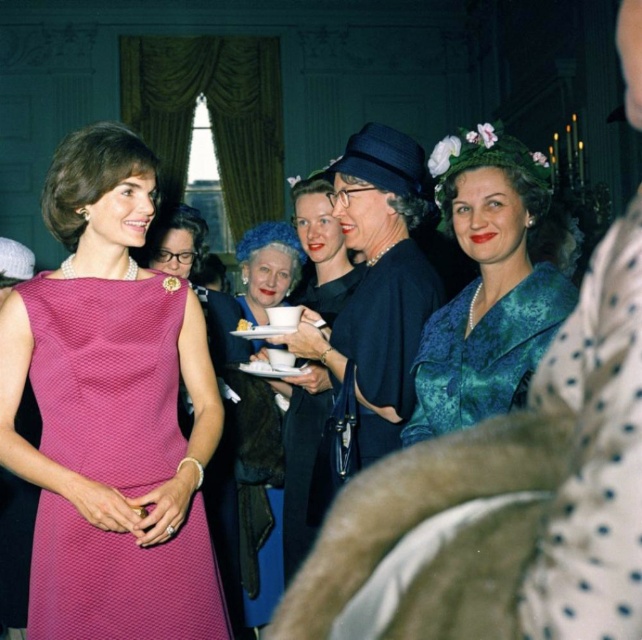
Question: Which point is farther to the camera?

Choices:
 (A) pink textured dress at center
 (B) teal velvet dress at center
 (C) velvet black dress at center

Answer: (C)

Question: Which point is closer to the camera taking this photo?

Choices:
 (A) (254, 266)
 (B) (456, 362)

Answer: (B)

Question: Is teal velvet dress at center above velvet black dress at center?

Choices:
 (A) yes
 (B) no

Answer: (A)

Question: Which point is farther to the camera?

Choices:
 (A) teal velvet dress at center
 (B) pink textured dress at center

Answer: (B)

Question: Does pink textured dress at center appear on the right side of teal velvet dress at center?

Choices:
 (A) yes
 (B) no

Answer: (B)

Question: Is pink textured dress at center positioned in front of teal velvet dress at center?

Choices:
 (A) yes
 (B) no

Answer: (B)